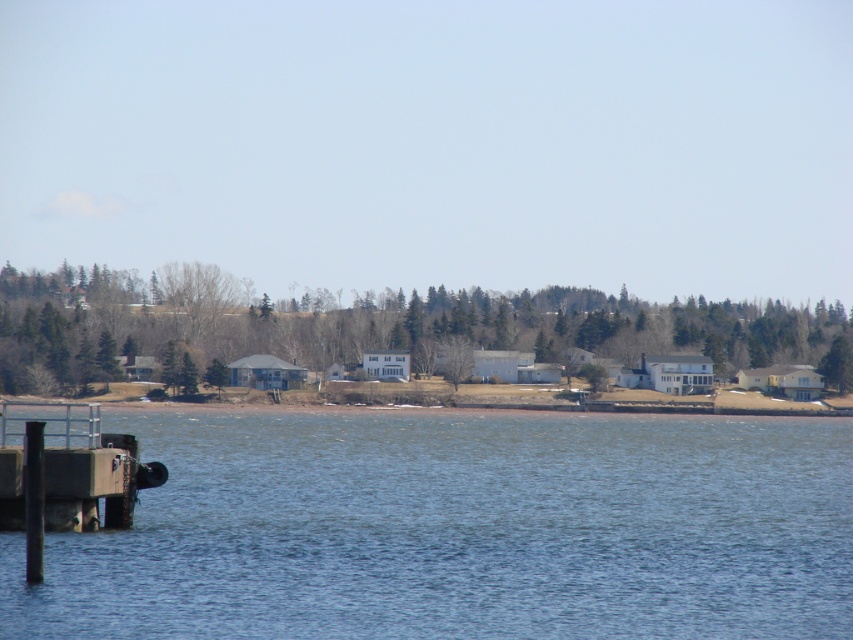
At what (x,y) coordinates should I click in order to perform the action: click on blue water at lower left. Please return your answer as a coordinate pair (x, y). Looking at the image, I should click on (460, 529).

Can you confirm if blue water at lower left is shorter than concrete dock at lower left?

In fact, blue water at lower left may be taller than concrete dock at lower left.

Measure the distance between blue water at lower left and camera.

They are 24.28 meters apart.

At what (x,y) coordinates should I click in order to perform the action: click on blue water at lower left. Please return your answer as a coordinate pair (x, y). Looking at the image, I should click on (460, 529).